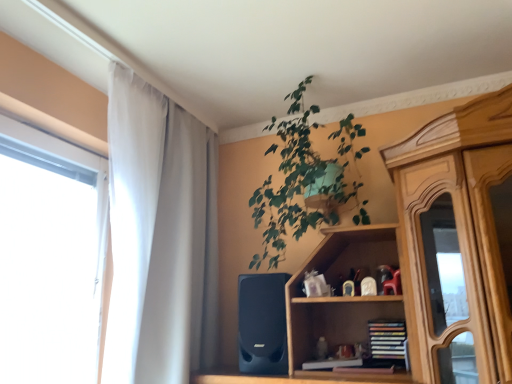
Question: Considering the relative sizes of hardcover books at center and green leafy plant at upper center in the image provided, is hardcover books at center shorter than green leafy plant at upper center?

Choices:
 (A) yes
 (B) no

Answer: (A)

Question: Can you confirm if hardcover books at center is wider than green leafy plant at upper center?

Choices:
 (A) yes
 (B) no

Answer: (B)

Question: Is hardcover books at center not within green leafy plant at upper center?

Choices:
 (A) yes
 (B) no

Answer: (A)

Question: Is hardcover books at center turned away from green leafy plant at upper center?

Choices:
 (A) yes
 (B) no

Answer: (B)

Question: Does hardcover books at center appear on the left side of green leafy plant at upper center?

Choices:
 (A) no
 (B) yes

Answer: (A)

Question: Considering the positions of hardcover books at center and black matte speaker at lower center in the image, is hardcover books at center wider or thinner than black matte speaker at lower center?

Choices:
 (A) wide
 (B) thin

Answer: (B)

Question: From the image's perspective, is hardcover books at center above or below black matte speaker at lower center?

Choices:
 (A) below
 (B) above

Answer: (A)

Question: Considering the positions of point (384, 352) and point (247, 284), is point (384, 352) closer or farther from the camera than point (247, 284)?

Choices:
 (A) farther
 (B) closer

Answer: (B)

Question: In the image, is hardcover books at center positioned in front of or behind black matte speaker at lower center?

Choices:
 (A) front
 (B) behind

Answer: (A)

Question: In the image, is black matte speaker at lower center positioned in front of or behind hardcover books at center?

Choices:
 (A) behind
 (B) front

Answer: (A)

Question: In the image, is black matte speaker at lower center on the left side or the right side of hardcover books at center?

Choices:
 (A) left
 (B) right

Answer: (A)

Question: Is point (271, 304) closer or farther from the camera than point (373, 342)?

Choices:
 (A) closer
 (B) farther

Answer: (B)

Question: From a real-world perspective, is black matte speaker at lower center positioned above or below hardcover books at center?

Choices:
 (A) below
 (B) above

Answer: (B)

Question: In terms of height, does black matte speaker at lower center look taller or shorter compared to white sheer curtain at left?

Choices:
 (A) short
 (B) tall

Answer: (A)

Question: Is black matte speaker at lower center situated inside white sheer curtain at left or outside?

Choices:
 (A) outside
 (B) inside

Answer: (A)